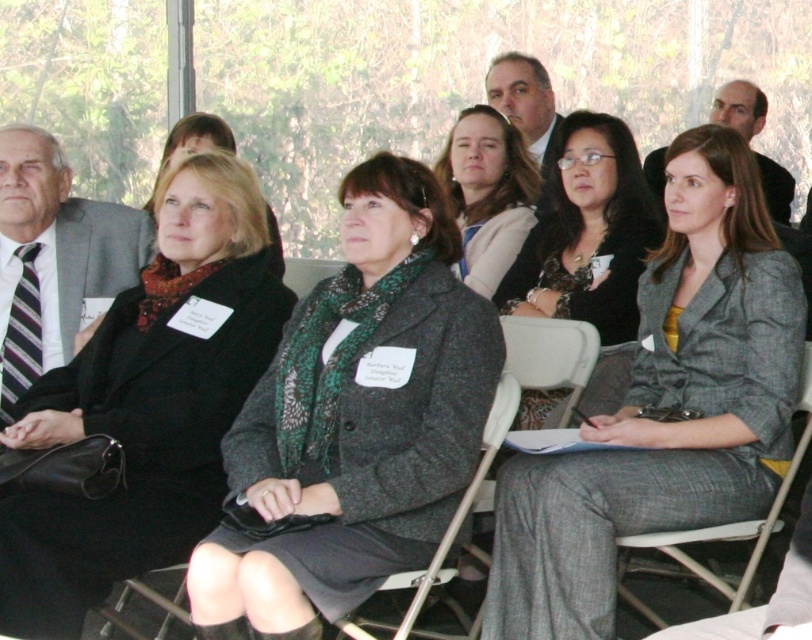
Question: From the image, what is the correct spatial relationship of charcoal wool coat at center in relation to black textured blazer at center?

Choices:
 (A) left
 (B) right

Answer: (A)

Question: Can you confirm if matte black coat at center is thinner than matte gray suit at center?

Choices:
 (A) yes
 (B) no

Answer: (B)

Question: Is gray wool blazer at center to the right of smooth bald head at upper right from the viewer's perspective?

Choices:
 (A) yes
 (B) no

Answer: (B)

Question: Estimate the real-world distances between objects in this image. Which object is farther from the smooth bald head at upper right?

Choices:
 (A) matte black coat at center
 (B) matte gray suit at center

Answer: (A)

Question: Which point is farther from the camera taking this photo?

Choices:
 (A) (68, 394)
 (B) (754, 100)
 (C) (551, 218)
 (D) (762, 522)

Answer: (B)

Question: Among these points, which one is farthest from the camera?

Choices:
 (A) (203, 176)
 (B) (767, 180)

Answer: (B)